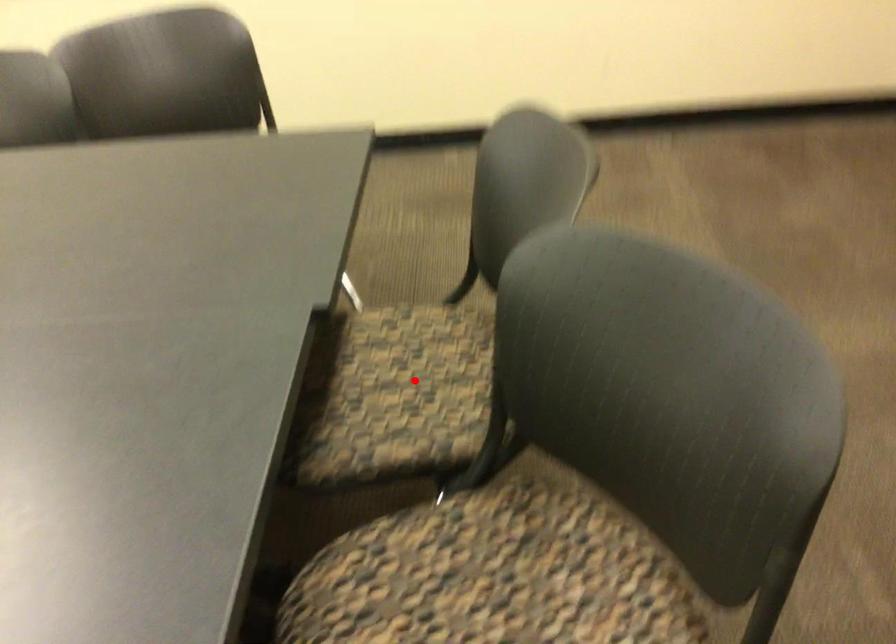
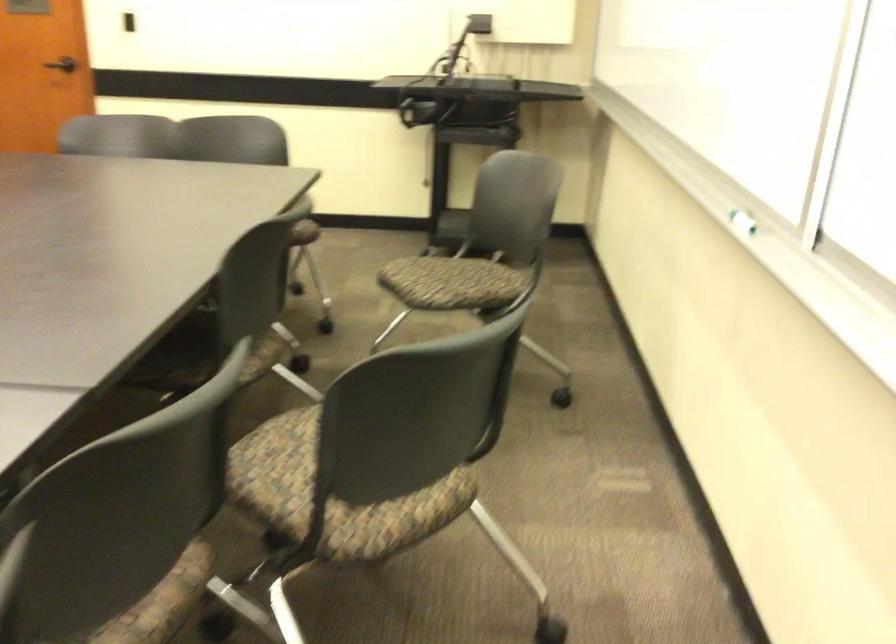
Question: I am providing you with two images of the same scene from different viewpoints. A red point is marked on the first image. Is the red point's position out of view in image 2?

Choices:
 (A) Yes
 (B) No

Answer: (A)